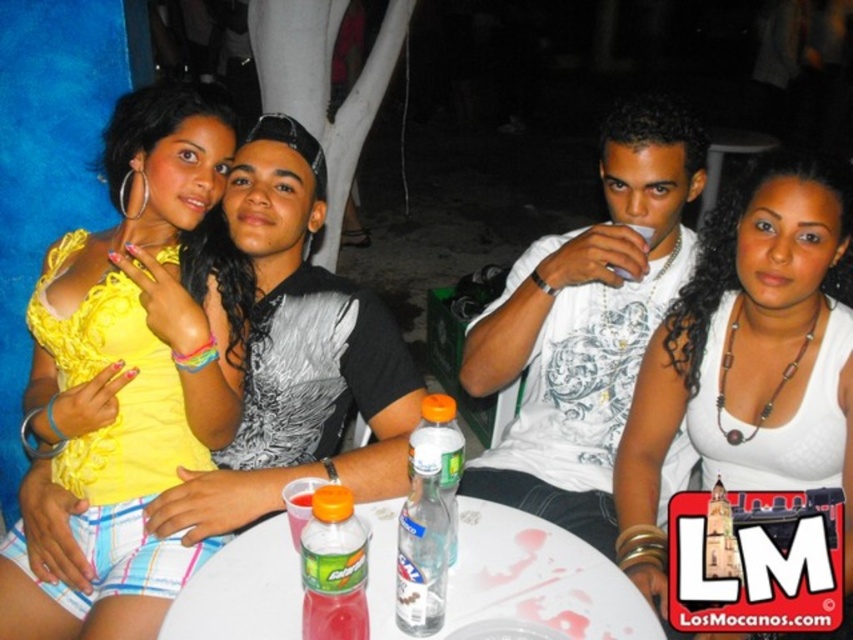
Question: Does yellow woven tank top at upper left come behind translucent plastic bottle at table center?

Choices:
 (A) no
 (B) yes

Answer: (B)

Question: Is white plastic table at center to the right of translucent plastic bottle at table center from the viewer's perspective?

Choices:
 (A) yes
 (B) no

Answer: (A)

Question: Which point is closer to the camera?

Choices:
 (A) white matte tank top at center
 (B) yellow woven tank top at upper left
 (C) translucent plastic bottle at table center

Answer: (C)

Question: Is yellow woven tank top at upper left behind white matte tank top at center?

Choices:
 (A) no
 (B) yes

Answer: (B)

Question: Which is farther from the white plastic table at center?

Choices:
 (A) white matte tank top at center
 (B) translucent plastic bottle at table center
 (C) yellow woven tank top at upper left

Answer: (C)

Question: Which object appears farthest from the camera in this image?

Choices:
 (A) yellow woven tank top at upper left
 (B) white matte tank top at center
 (C) translucent plastic bottle at table center
 (D) white plastic table at center

Answer: (A)